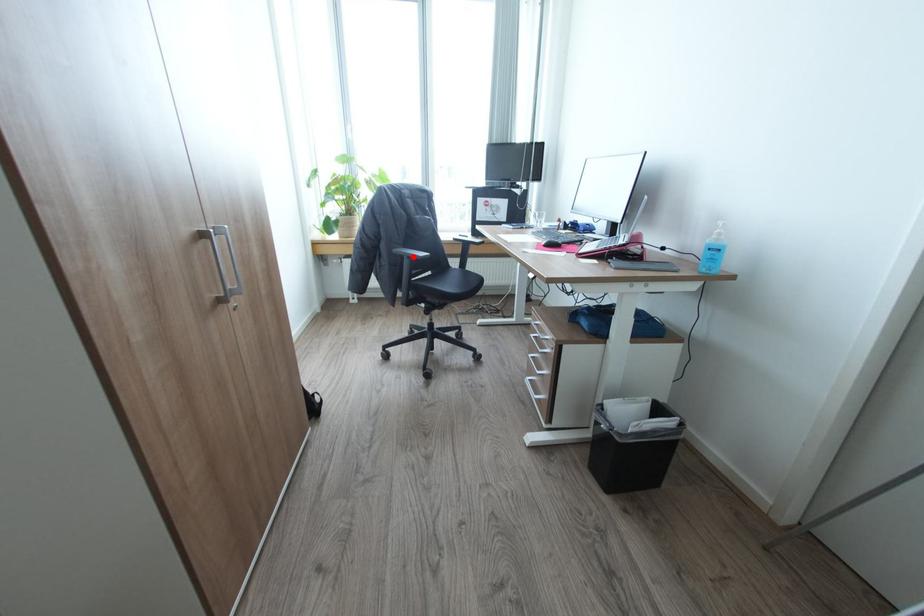
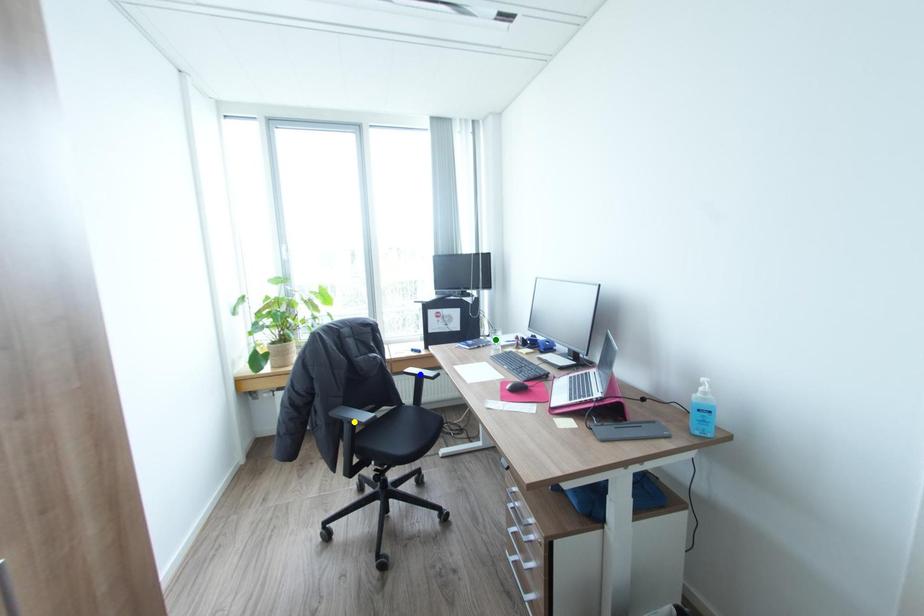
Question: I am providing you with two images of the same scene from different viewpoints. A red point is marked on the first image. You are given multiple points on the second image. Which spot in image 2 lines up with the point in image 1?

Choices:
 (A) blue point
 (B) green point
 (C) yellow point

Answer: (C)